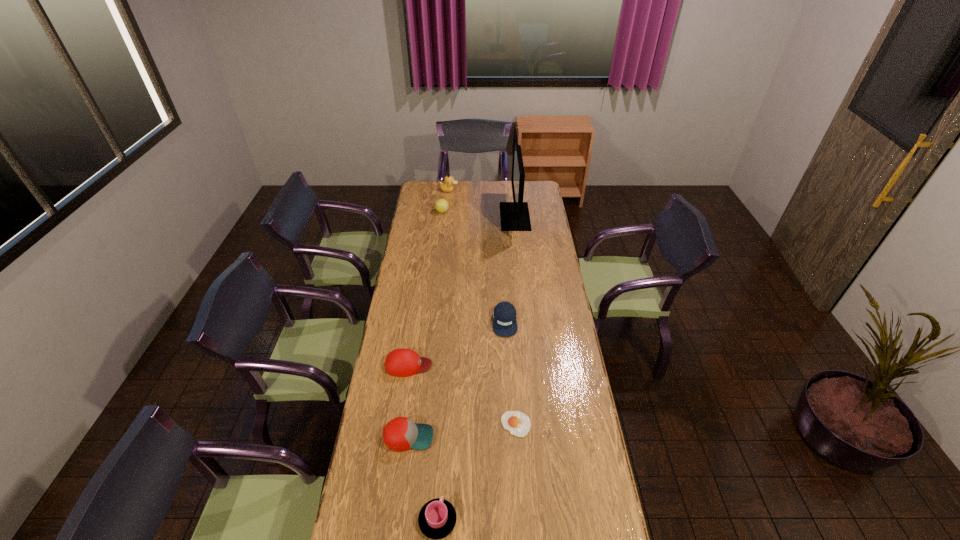
The image size is (960, 540). Find the location of `the tallest object`. the tallest object is located at coordinates (514, 216).

The width and height of the screenshot is (960, 540). In order to click on duckling in this screenshot , I will do `click(447, 186)`.

This screenshot has height=540, width=960. In order to click on the second tallest object in this screenshot , I will do `click(447, 186)`.

Locate an element on the screen. This screenshot has width=960, height=540. tennis ball is located at coordinates (441, 205).

Find the location of `the fifth farthest object`. the fifth farthest object is located at coordinates (402, 362).

Where is `the farthest baseball cap`? This screenshot has height=540, width=960. the farthest baseball cap is located at coordinates (504, 315).

Locate an element on the screen. This screenshot has width=960, height=540. the rightmost baseball cap is located at coordinates (504, 315).

Locate an element on the screen. the nearest baseball cap is located at coordinates (400, 434).

Image resolution: width=960 pixels, height=540 pixels. What are the coordinates of `the shortest object` in the screenshot? It's located at (517, 423).

What are the coordinates of `vacant area located on the screen side of the tallest object` in the screenshot? It's located at (463, 217).